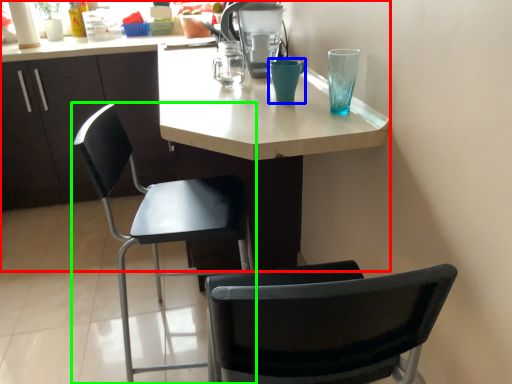
Question: Estimate the real-world distances between objects in this image. Which object is closer to desk (highlighted by a red box), teal (highlighted by a blue box) or chair (highlighted by a green box)?

Choices:
 (A) teal
 (B) chair

Answer: (B)